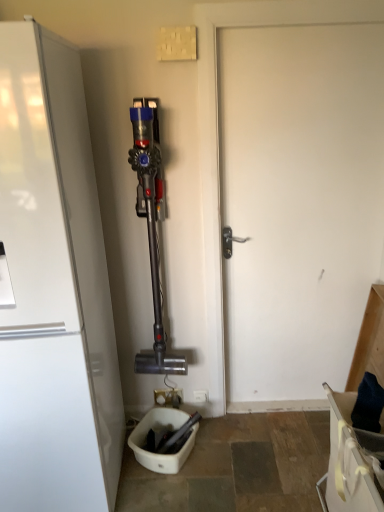
This screenshot has height=512, width=384. What do you see at coordinates (201, 396) in the screenshot? I see `white plastic electric outlet at center` at bounding box center [201, 396].

Identify the location of white plastic electric outlet at center. This screenshot has height=512, width=384. (201, 396).

Is white matte door at center facing away from white glossy refrigerator at left?

No, white glossy refrigerator at left is not at the back of white matte door at center.

Is white matte door at center to the right of white glossy refrigerator at left from the viewer's perspective?

Yes.

In terms of width, does white matte door at center look wider or thinner when compared to white glossy refrigerator at left?

In the image, white matte door at center appears to be more narrow than white glossy refrigerator at left.

Is white matte door at center inside the boundaries of white glossy refrigerator at left, or outside?

white matte door at center cannot be found inside white glossy refrigerator at left.

Is point (20, 284) positioned after point (275, 318)?

No, it is not.

Is white glossy refrigerator at left beside white matte door at center?

There is a gap between white glossy refrigerator at left and white matte door at center.

In the scene shown: Is white glossy refrigerator at left oriented away from white matte door at center?

No, white glossy refrigerator at left is not facing the opposite direction of white matte door at center.

From a real-world perspective, who is located higher, white matte door at center or white plastic electric outlet at center?

In real-world perspective, white matte door at center is above.

Relative to white plastic electric outlet at center, is white matte door at center in front or behind?

white matte door at center is positioned closer to the viewer than white plastic electric outlet at center.

Considering the sizes of objects white matte door at center and white plastic electric outlet at center in the image provided, who is smaller, white matte door at center or white plastic electric outlet at center?

Smaller between the two is white plastic electric outlet at center.

Do you think white matte door at center is within white plastic electric outlet at center, or outside of it?

white matte door at center is not enclosed by white plastic electric outlet at center.

Considering the sizes of white glossy refrigerator at left and white plastic electric outlet at center in the image, is white glossy refrigerator at left taller or shorter than white plastic electric outlet at center?

Considering their sizes, white glossy refrigerator at left has more height than white plastic electric outlet at center.

Considering the sizes of white glossy refrigerator at left and white plastic electric outlet at center in the image, is white glossy refrigerator at left bigger or smaller than white plastic electric outlet at center?

white glossy refrigerator at left is bigger than white plastic electric outlet at center.

From a real-world perspective, which is physically above, white glossy refrigerator at left or white plastic electric outlet at center?

white glossy refrigerator at left is physically above.

Is white plastic electric outlet at center turned away from white matte door at center?

white plastic electric outlet at center is not turned away from white matte door at center.

Which of these two, white plastic electric outlet at center or white matte door at center, stands shorter?

white plastic electric outlet at center.

Considering the positions of point (198, 393) and point (293, 304), is point (198, 393) closer or farther from the camera than point (293, 304)?

Point (198, 393) appears to be farther away from the viewer than point (293, 304).

This screenshot has height=512, width=384. Find the location of `electric outlet directly beneath the white matte door at center (from a real-world perspective)`. electric outlet directly beneath the white matte door at center (from a real-world perspective) is located at coordinates click(201, 396).

What's the angular difference between white plastic electric outlet at center and white glossy refrigerator at left's facing directions?

white plastic electric outlet at center and white glossy refrigerator at left are facing 0.197 degrees away from each other.

Is point (197, 401) less distant than point (13, 291)?

No, it is not.

Looking at this image, is white plastic electric outlet at center at the left side of white glossy refrigerator at left?

No, white plastic electric outlet at center is not to the left of white glossy refrigerator at left.

Locate an element on the screen. The width and height of the screenshot is (384, 512). refrigerator lying in front of the white matte door at center is located at coordinates (53, 288).

In the image, there is a white matte door at center. Identify the location of refrigerator below it (from a real-world perspective). The width and height of the screenshot is (384, 512). [53, 288].

Estimate the real-world distances between objects in this image. Which object is further from white glossy refrigerator at left, white plastic electric outlet at center or white matte door at center?

Among the two, white plastic electric outlet at center is located further to white glossy refrigerator at left.

Considering their positions, is white plastic electric outlet at center positioned closer to white matte door at center than white glossy refrigerator at left?

Based on the image, white glossy refrigerator at left appears to be nearer to white matte door at center.

Considering their positions, is white matte door at center positioned closer to white plastic electric outlet at center than white glossy refrigerator at left?

white matte door at center lies closer to white plastic electric outlet at center than the other object.

Looking at the image, which one is located further to white glossy refrigerator at left, white matte door at center or white plastic electric outlet at center?

The object further to white glossy refrigerator at left is white plastic electric outlet at center.

Based on their spatial positions, is white glossy refrigerator at left or white matte door at center closer to white plastic electric outlet at center?

Based on the image, white matte door at center appears to be nearer to white plastic electric outlet at center.

Estimate the real-world distances between objects in this image. Which object is closer to white matte door at center, white glossy refrigerator at left or white plastic electric outlet at center?

white glossy refrigerator at left is positioned closer to the anchor white matte door at center.

The width and height of the screenshot is (384, 512). In order to click on electric outlet situated between white glossy refrigerator at left and white matte door at center from left to right in this screenshot , I will do `click(201, 396)`.